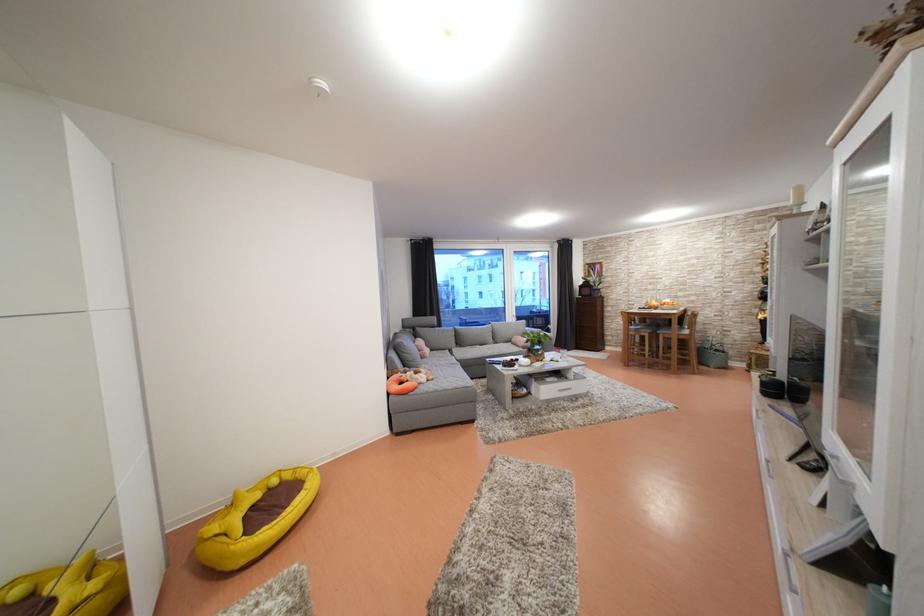
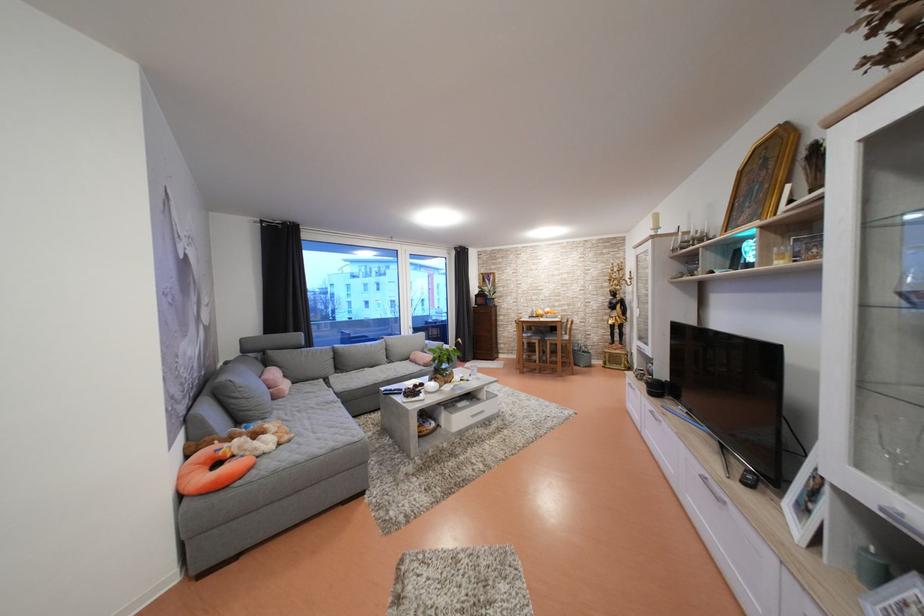
Question: The first image is from the beginning of the video and the second image is from the end. How did the camera likely rotate when shooting the video?

Choices:
 (A) Left
 (B) Right
 (C) Up
 (D) Down

Answer: (B)